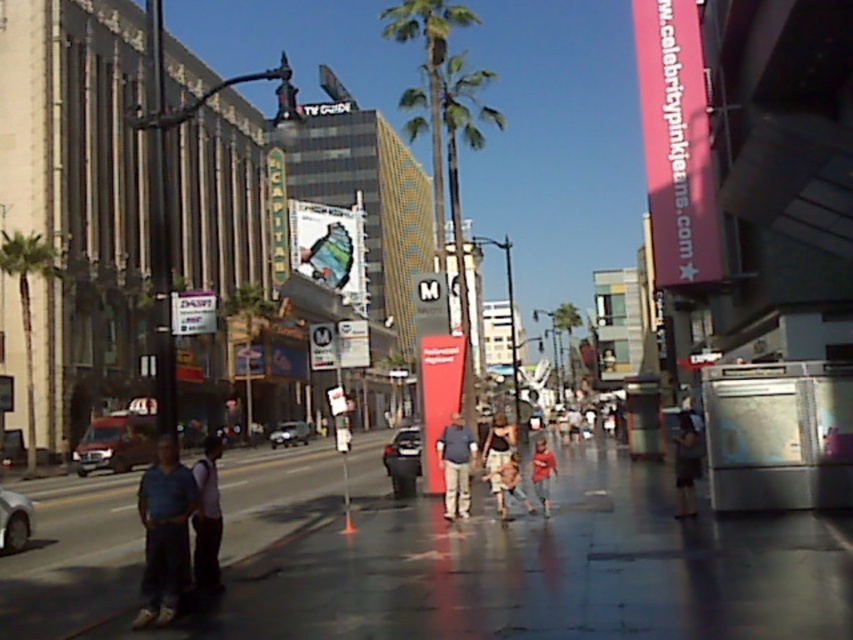
Question: From the image, what is the correct spatial relationship of dark blue jeans at center in relation to metallic silver car at center?

Choices:
 (A) above
 (B) below

Answer: (A)

Question: Which point is closer to the camera?

Choices:
 (A) (517, 465)
 (B) (486, 451)
 (C) (466, 468)

Answer: (A)

Question: Which object appears farthest from the camera in this image?

Choices:
 (A) green leafy palm tree at left
 (B) metallic silver car at center
 (C) shiny silver sedan at center
 (D) denim shorts at center

Answer: (C)

Question: Which object appears closest to the camera in this image?

Choices:
 (A) metallic silver car at center
 (B) dark blue jeans at center
 (C) metallic silver van at left
 (D) denim pants at center

Answer: (B)

Question: Can you confirm if blue denim jeans at lower left is positioned below metallic silver van at left?

Choices:
 (A) yes
 (B) no

Answer: (B)

Question: Can you confirm if light blue shirt at center is wider than denim pants at center?

Choices:
 (A) no
 (B) yes

Answer: (B)